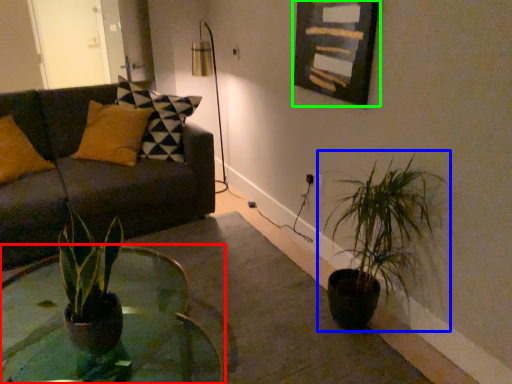
Question: Which object is positioned farthest from coffee table (highlighted by a red box)? Select from houseplant (highlighted by a blue box) and picture frame (highlighted by a green box).

Choices:
 (A) houseplant
 (B) picture frame

Answer: (B)